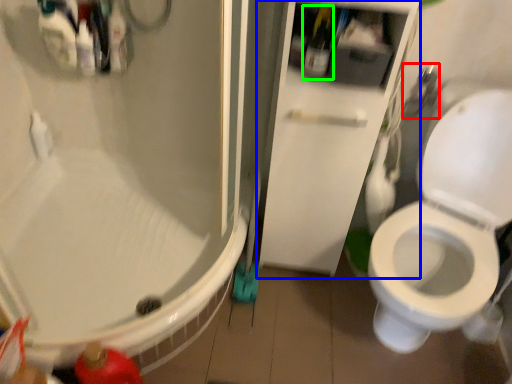
Question: Which object is the closest to the shower (highlighted by a red box)? Choose among these: screen door (highlighted by a blue box) or bottle (highlighted by a green box).

Choices:
 (A) screen door
 (B) bottle

Answer: (B)